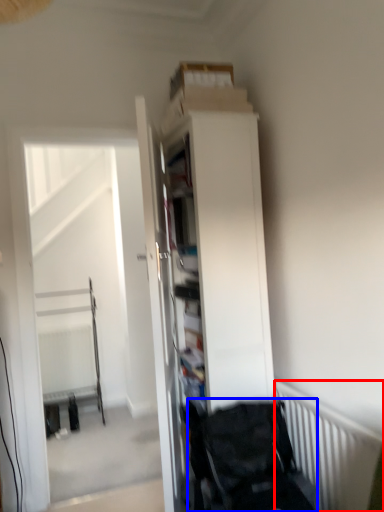
Question: Which point is further to the camera, radiator (highlighted by a red box) or baby carriage (highlighted by a blue box)?

Choices:
 (A) radiator
 (B) baby carriage

Answer: (B)